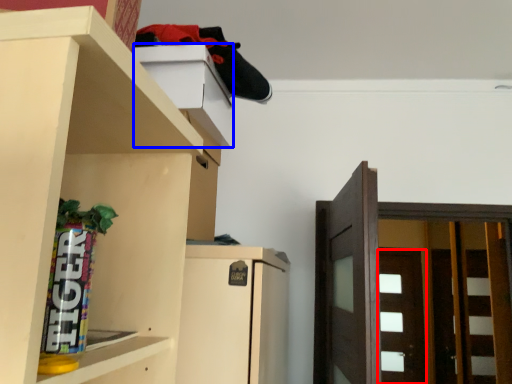
Question: Which point is further to the camera, door (highlighted by a red box) or cabinet (highlighted by a blue box)?

Choices:
 (A) door
 (B) cabinet

Answer: (A)